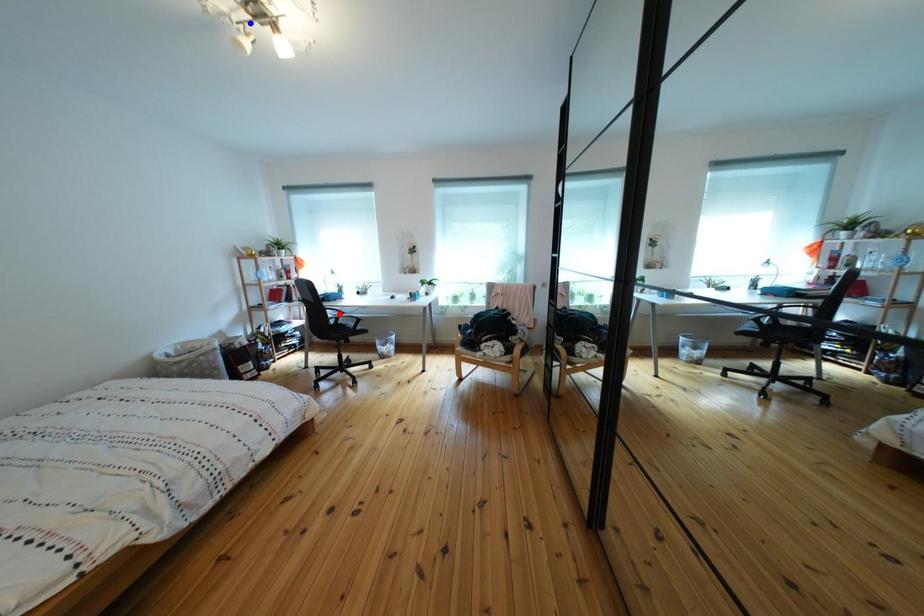
Question: Two points are marked on the image. Which point is closer to the camera?

Choices:
 (A) Blue point is closer.
 (B) Red point is closer.

Answer: (A)